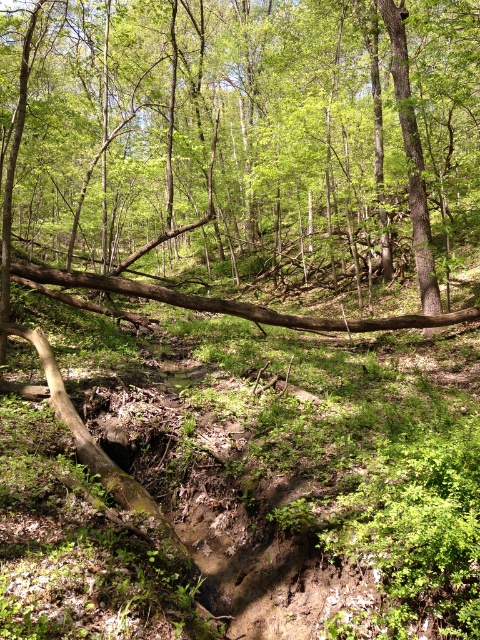
You are a hiker trying to cross the stream in the forest. You see a brown rough log at center and a brown rough tree trunk at upper center. Which of these two objects is closer to you?

The brown rough log at center is closer to you because it is located at the center of the scene, while the brown rough tree trunk at upper center is positioned further away towards the upper part of the scene.

You are a hiker trying to cross the stream. You see the brown rough log at center and the brown rough tree trunk at upper center. Which one is closer to your current position if you are standing on the left side of the stream?

The brown rough log at center is closer to your current position because it is positioned to the left of the brown rough tree trunk at upper center, and you are standing on the left side of the stream.

You are a hiker trying to cross the stream in the forest. You see a brown rough log at center and a brown rough tree trunk at upper center. Which object could provide a wider surface for you to walk on?

The brown rough log at center might be wider than brown rough tree trunk at upper center, so it could provide a wider surface for walking across the stream.